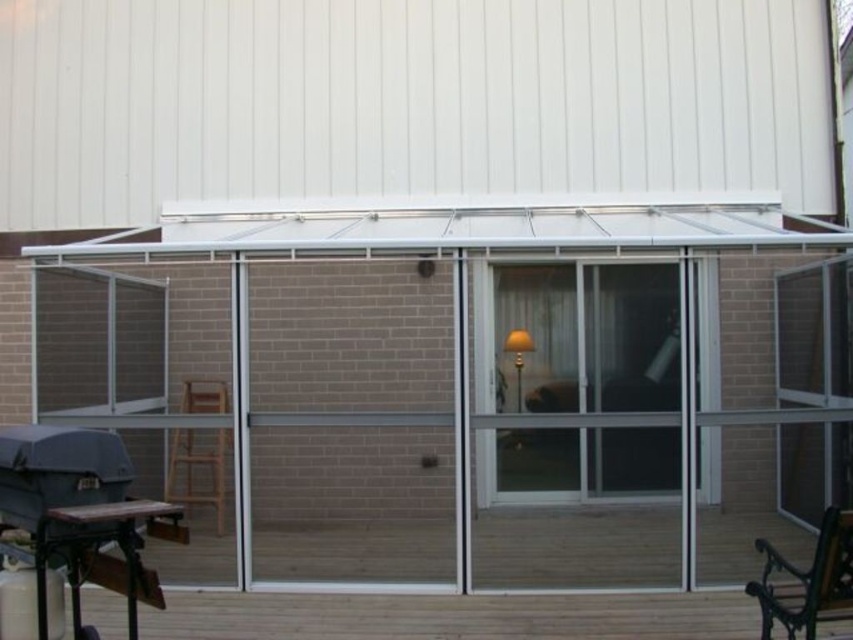
Question: Is wooden deck at lower center smaller than metallic green bench at lower right?

Choices:
 (A) no
 (B) yes

Answer: (A)

Question: Where is matte black barbecue grill at lower left located in relation to wooden chair at lower left in the image?

Choices:
 (A) left
 (B) right

Answer: (B)

Question: Which point is farther from the camera taking this photo?

Choices:
 (A) (579, 369)
 (B) (206, 440)
 (C) (814, 614)

Answer: (B)

Question: Among these objects, which one is farthest from the camera?

Choices:
 (A) clear glass screen door at center
 (B) matte black barbecue grill at lower left

Answer: (A)

Question: Which of the following is the closest to the observer?

Choices:
 (A) (41, 538)
 (B) (581, 435)
 (C) (113, 611)
 (D) (755, 547)

Answer: (A)

Question: Does wooden deck at lower center come in front of wooden chair at lower left?

Choices:
 (A) no
 (B) yes

Answer: (B)